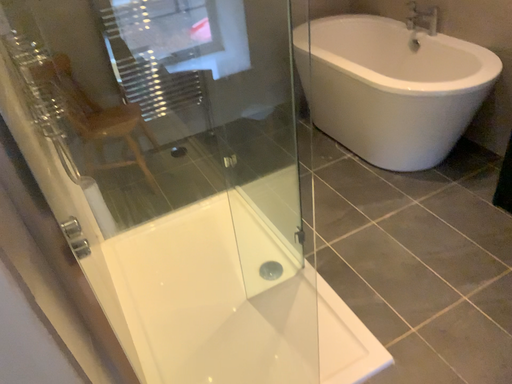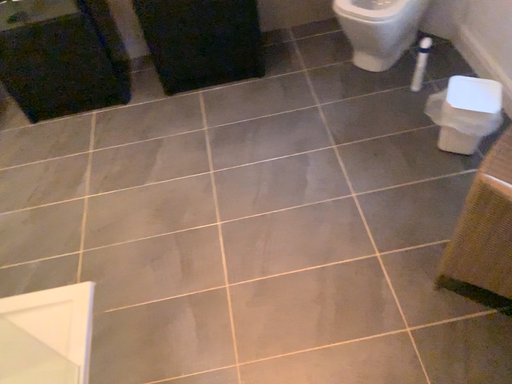
Question: How did the camera likely rotate when shooting the video?

Choices:
 (A) rotated right
 (B) rotated left

Answer: (A)